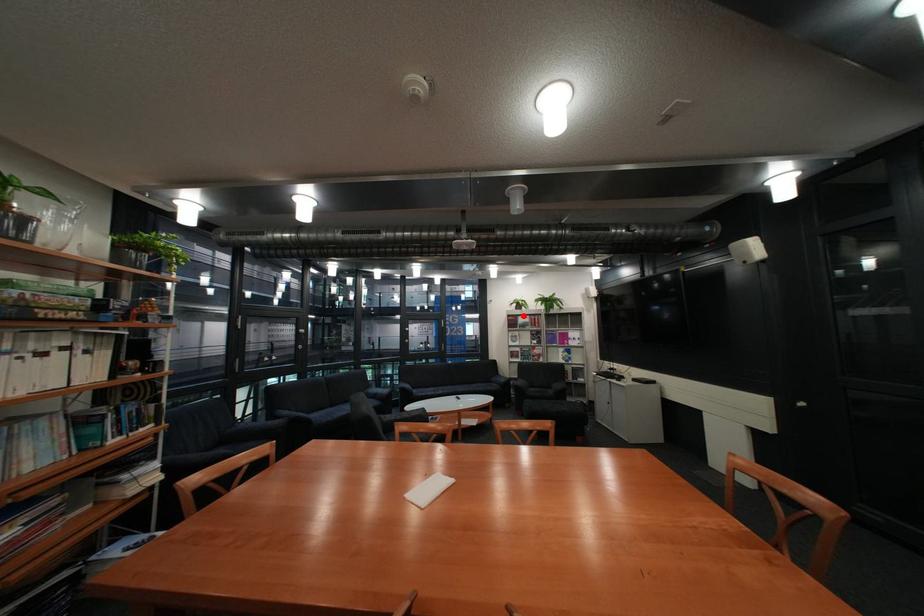
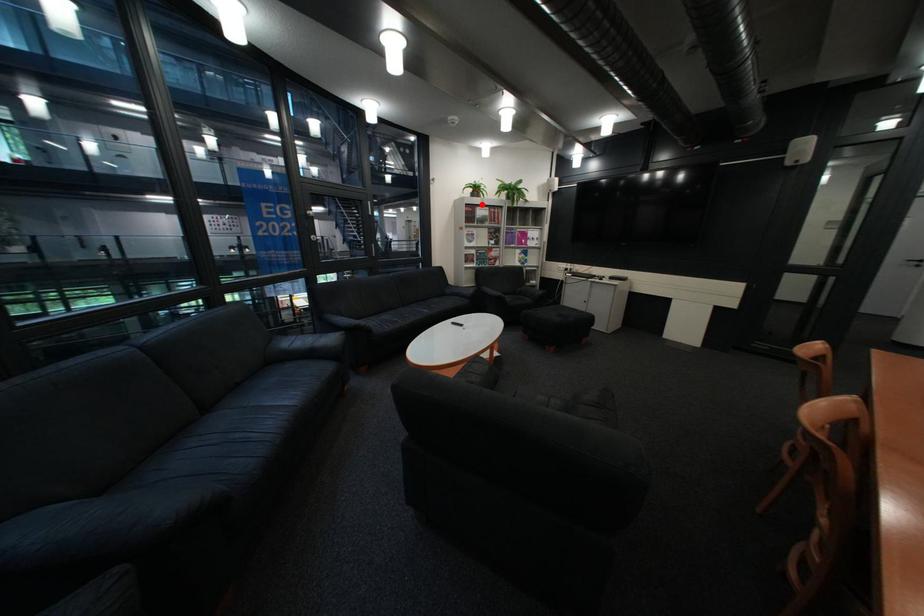
From the picture: I am providing you with two images of the same scene from different viewpoints. A red point is marked on the first image and another point is marked on the second image. Is the red point in image1 aligned with the point shown in image2?

Yes